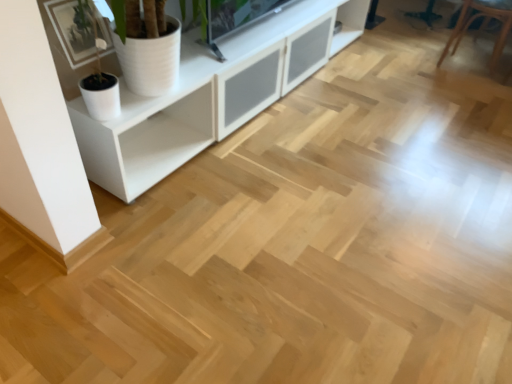
In order to click on free space in front of brown leather armchair at upper right in this screenshot , I will do `click(470, 87)`.